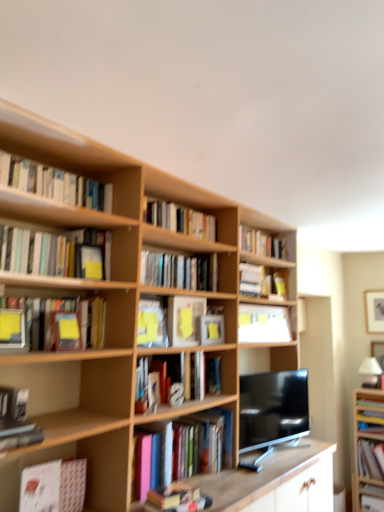
Where is `blank space situated above hardcover books at upper left, which is the thirteenth book in bottom-to-top order (from a real-world perspective)`? The image size is (384, 512). blank space situated above hardcover books at upper left, which is the thirteenth book in bottom-to-top order (from a real-world perspective) is located at coordinates (68, 170).